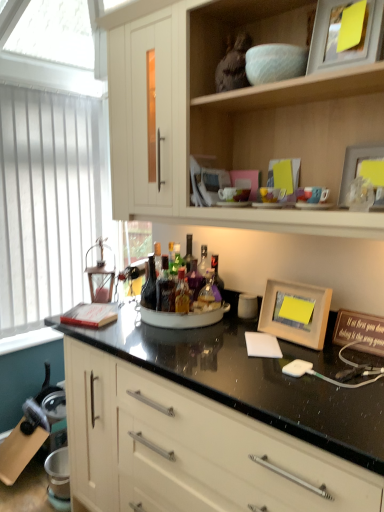
Question: Can you confirm if translucent glass bottle at center, the 1th bottle from the right, is wider than white vertical blinds at left?

Choices:
 (A) no
 (B) yes

Answer: (B)

Question: Is translucent glass bottle at center, the 3th bottle from the left, not inside white vertical blinds at left?

Choices:
 (A) yes
 (B) no

Answer: (A)

Question: Is translucent glass bottle at center, the 3th bottle from the left, thinner than white vertical blinds at left?

Choices:
 (A) yes
 (B) no

Answer: (B)

Question: Is translucent glass bottle at center, the 1th bottle from the right, shorter than white vertical blinds at left?

Choices:
 (A) yes
 (B) no

Answer: (A)

Question: Is translucent glass bottle at center, the 3th bottle from the left, smaller than white vertical blinds at left?

Choices:
 (A) yes
 (B) no

Answer: (A)

Question: From a real-world perspective, is translucent glass bottle at center, which is the third bottle from right to left, physically located above or below wooden picture frame at upper right, the third picture frame when ordered from bottom to top?

Choices:
 (A) above
 (B) below

Answer: (B)

Question: Is translucent glass bottle at center, which is the third bottle from right to left, bigger or smaller than wooden picture frame at upper right, the third picture frame when ordered from bottom to top?

Choices:
 (A) small
 (B) big

Answer: (A)

Question: Is point (152, 289) positioned closer to the camera than point (367, 25)?

Choices:
 (A) farther
 (B) closer

Answer: (A)

Question: From the image's perspective, is translucent glass bottle at center, which is the third bottle from right to left, located above or below wooden picture frame at upper right, the first picture frame when ordered from top to bottom?

Choices:
 (A) below
 (B) above

Answer: (A)

Question: Choose the correct answer: Is matte wooden picture frame at upper right, which is the second picture frame from top to bottom, inside light wood cabinet at upper center, which ranks as the 2th cabinetry in bottom-to-top order, or outside it?

Choices:
 (A) inside
 (B) outside

Answer: (A)

Question: From a real-world perspective, is matte wooden picture frame at upper right, the 2th picture frame in the bottom-to-top sequence, above or below light wood cabinet at upper center, the 1th cabinetry from the top?

Choices:
 (A) below
 (B) above

Answer: (A)

Question: Is matte wooden picture frame at upper right, the 2th picture frame in the bottom-to-top sequence, wider or thinner than light wood cabinet at upper center, which ranks as the 2th cabinetry in bottom-to-top order?

Choices:
 (A) thin
 (B) wide

Answer: (A)

Question: Considering their positions, is matte wooden picture frame at upper right, the 2th picture frame in the bottom-to-top sequence, located in front of or behind light wood cabinet at upper center, which ranks as the 2th cabinetry in bottom-to-top order?

Choices:
 (A) behind
 (B) front

Answer: (A)

Question: In terms of width, does matte wooden picture frame at upper right, which is the second picture frame from top to bottom, look wider or thinner when compared to translucent glass bottle at center, the 3th bottle from the left?

Choices:
 (A) thin
 (B) wide

Answer: (A)

Question: In terms of height, does matte wooden picture frame at upper right, the 2th picture frame in the bottom-to-top sequence, look taller or shorter compared to translucent glass bottle at center, the 3th bottle from the left?

Choices:
 (A) tall
 (B) short

Answer: (B)